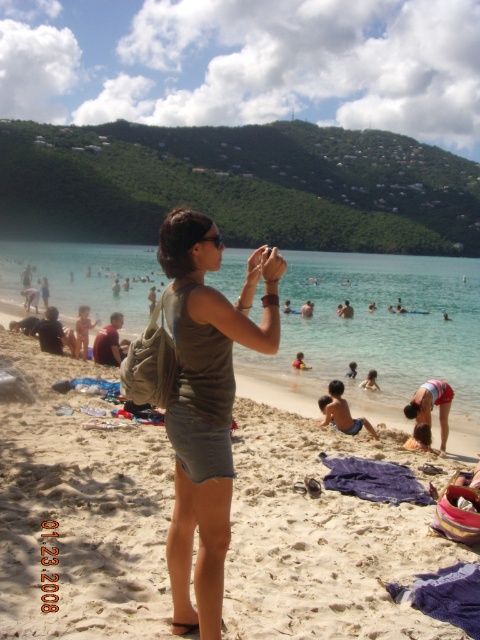
Question: Does light pink fabric at lower left have a smaller size compared to smooth sand at lower center?

Choices:
 (A) no
 (B) yes

Answer: (A)

Question: Which object is positioned closest to the red fabric bikini at lower right?

Choices:
 (A) matte gray tank top at center
 (B) yellow life vest at center

Answer: (A)

Question: Which of the following is the farthest from the observer?

Choices:
 (A) (213, 632)
 (B) (58, 529)
 (C) (34, 257)

Answer: (C)

Question: Estimate the real-world distances between objects in this image. Which object is closer to the tan skin boy at center?

Choices:
 (A) beige sand at center
 (B) red fabric bikini at lower right
 (C) smooth sand at lower center
 (D) yellow life vest at center

Answer: (B)

Question: Can you confirm if matte gray tank top at center is smaller than light pink fabric at lower left?

Choices:
 (A) yes
 (B) no

Answer: (A)

Question: In this image, where is red fabric bikini at lower right located relative to matte gray tank top at center?

Choices:
 (A) below
 (B) above

Answer: (A)